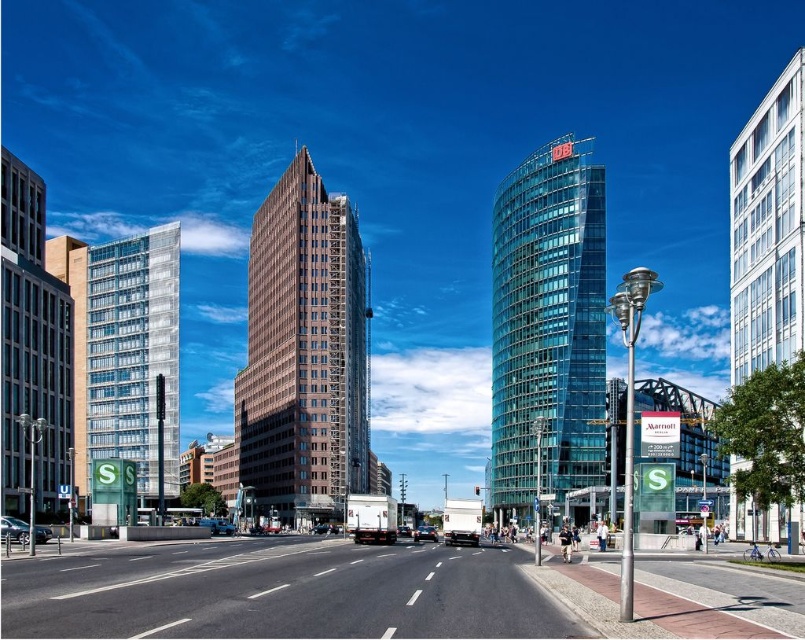
Locate an element on the screen. clear glass building at left is located at coordinates (124, 352).

Which of these two, clear glass building at left or white glass building at right, stands shorter?

Standing shorter between the two is clear glass building at left.

Identify the location of clear glass building at left. (124, 352).

Does dark gray concrete building at left appear under metallic silver car at lower left?

No.

Does point (0, 193) come behind point (35, 528)?

Yes.

This screenshot has height=640, width=805. What are the coordinates of `dark gray concrete building at left` in the screenshot? It's located at (32, 349).

Consider the image. Can you confirm if brown brick building at center is bigger than transparent glass tower at center?

No.

Who is lower down, brown brick building at center or transparent glass tower at center?

transparent glass tower at center

Is point (269, 429) closer to viewer compared to point (578, 397)?

No, (269, 429) is further to viewer.

Find the location of a particular element. brown brick building at center is located at coordinates (303, 355).